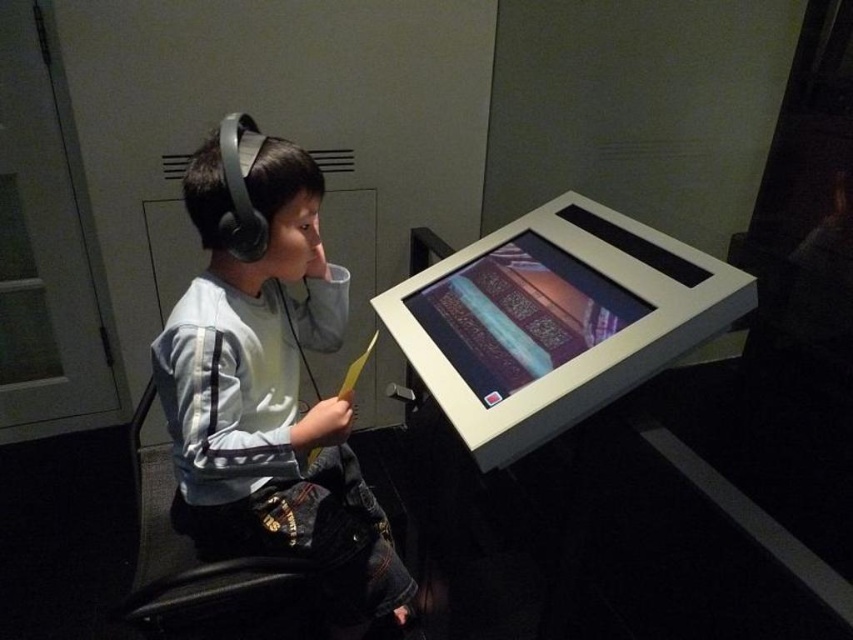
Question: Based on their relative distances, which object is nearer to the black leather chair at left?

Choices:
 (A) matte glass computer screen at center
 (B) light gray fabric shirt at center

Answer: (B)

Question: Among these points, which one is nearest to the camera?

Choices:
 (A) (515, 372)
 (B) (160, 580)

Answer: (B)

Question: Which object is positioned closest to the matte glass computer screen at center?

Choices:
 (A) black leather chair at left
 (B) light gray fabric shirt at center

Answer: (B)

Question: Does light gray fabric shirt at center have a smaller size compared to matte glass computer screen at center?

Choices:
 (A) no
 (B) yes

Answer: (A)

Question: Does matte glass computer screen at center lie in front of black leather chair at left?

Choices:
 (A) yes
 (B) no

Answer: (B)

Question: Is light gray fabric shirt at center closer to the viewer compared to matte glass computer screen at center?

Choices:
 (A) yes
 (B) no

Answer: (A)